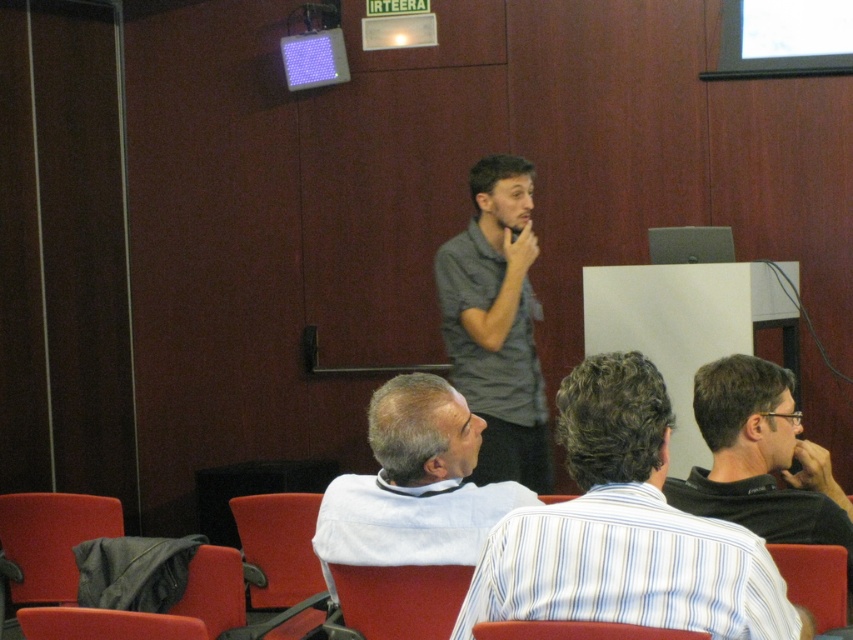
You are organizing a photo shoot in this conference room and need to ensure that all participants are visible in the frame. Given that the striped cotton shirt at center and the white shirt at center are both in the center, which shirt should you focus on to capture the broader silhouette?

The striped cotton shirt at center has a greater width than the white shirt at center, so focusing on the striped cotton shirt at center will ensure capturing the broader silhouette.

You are a photographer positioned at the back of the conference room. You want to take a photo of the white shirt at center and the red fabric chair at lower center. Which object is closer to your camera lens?

The white shirt at center is closer to the camera lens because it is further to the viewer than the red fabric chair at lower center.

You are standing at the back of the conference room and want to hand a document to the white shirt at center. The document is 1 foot thick. Can you reach them without moving closer?

→ The distance between you and the white shirt at center is 6.43 feet. Since the document is only 1 foot thick, you cannot reach them without moving closer because the distance is greater than the document length.